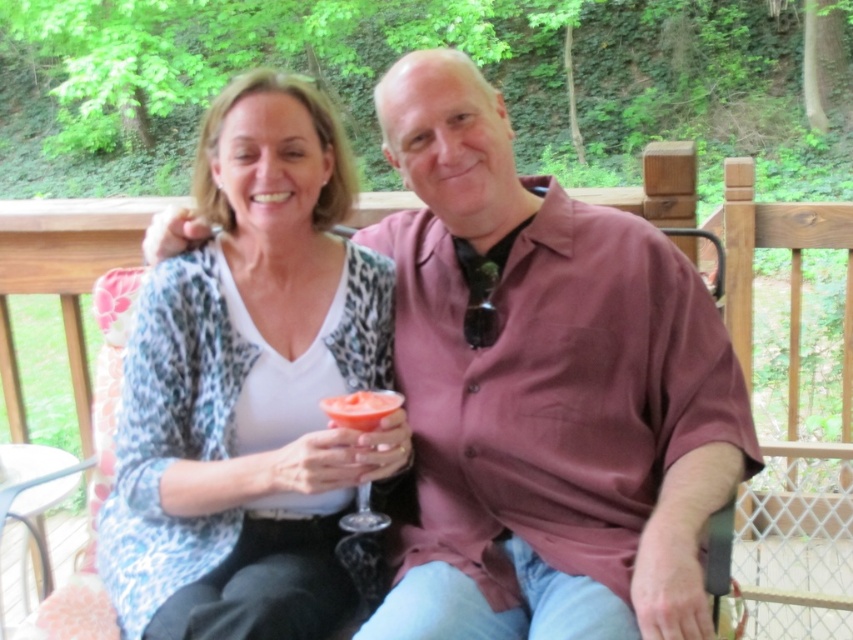
Is point (672, 381) closer to viewer compared to point (357, 410)?

No, (672, 381) is behind (357, 410).

Between pink matte shirt at center and translucent glass at center, which one is positioned higher?

pink matte shirt at center

Where is `pink matte shirt at center`? pink matte shirt at center is located at coordinates (544, 388).

This screenshot has height=640, width=853. Find the location of `pink matte shirt at center`. pink matte shirt at center is located at coordinates (544, 388).

This screenshot has height=640, width=853. What do you see at coordinates (544, 388) in the screenshot?
I see `pink matte shirt at center` at bounding box center [544, 388].

Can you confirm if pink matte shirt at center is positioned above white leopard print cardigan at center?

Incorrect, pink matte shirt at center is not positioned above white leopard print cardigan at center.

This screenshot has width=853, height=640. What are the coordinates of `pink matte shirt at center` in the screenshot? It's located at (544, 388).

Find the location of `pink matte shirt at center`. pink matte shirt at center is located at coordinates click(x=544, y=388).

Does white leopard print cardigan at center have a greater height compared to translucent glass at center?

Indeed, white leopard print cardigan at center has a greater height compared to translucent glass at center.

Is point (303, 88) in front of point (332, 412)?

No, it is behind (332, 412).

Measure the distance between point (329, 481) and camera.

Point (329, 481) and camera are 3.98 feet apart.

Image resolution: width=853 pixels, height=640 pixels. I want to click on white leopard print cardigan at center, so pyautogui.click(x=248, y=387).